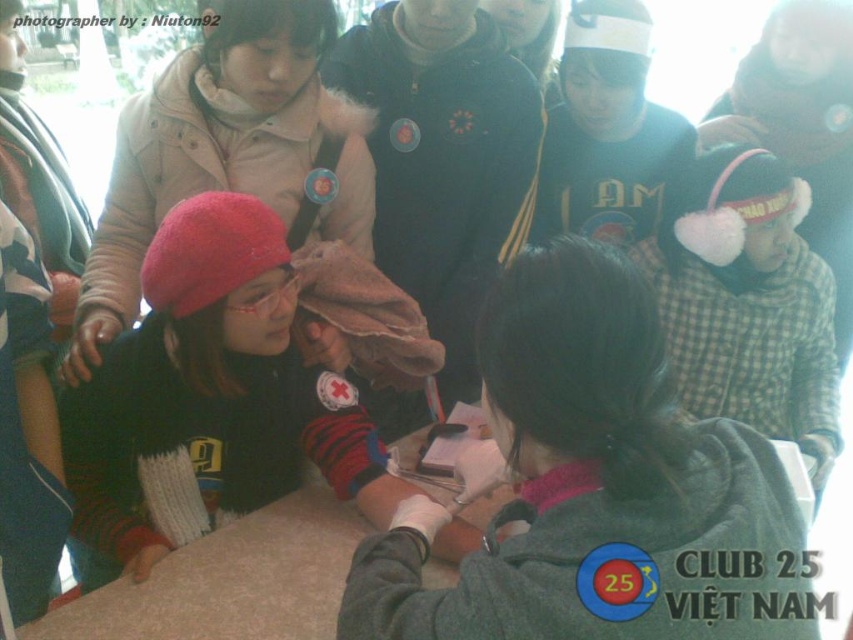
Question: Is matte red beanie at left above matte pink hat at left?

Choices:
 (A) no
 (B) yes

Answer: (A)

Question: Which of the following is the closest to the observer?

Choices:
 (A) (607, 72)
 (B) (279, 220)
 (C) (830, 292)
 (D) (323, 214)

Answer: (B)

Question: Can you confirm if matte pink hat at left is bigger than green cotton sweater at upper center?

Choices:
 (A) yes
 (B) no

Answer: (A)

Question: Is matte pink hat at left positioned before plaid fabric at center?

Choices:
 (A) no
 (B) yes

Answer: (B)

Question: Which object is the farthest from the matte red beanie at left?

Choices:
 (A) plaid fabric at center
 (B) green cotton sweater at upper center
 (C) matte pink hat at left
 (D) green fleece jacket at center

Answer: (B)

Question: Among these points, which one is farthest from the camera?

Choices:
 (A) 300,8
 (B) 735,147
 (C) 86,516
 (D) 548,353

Answer: (B)